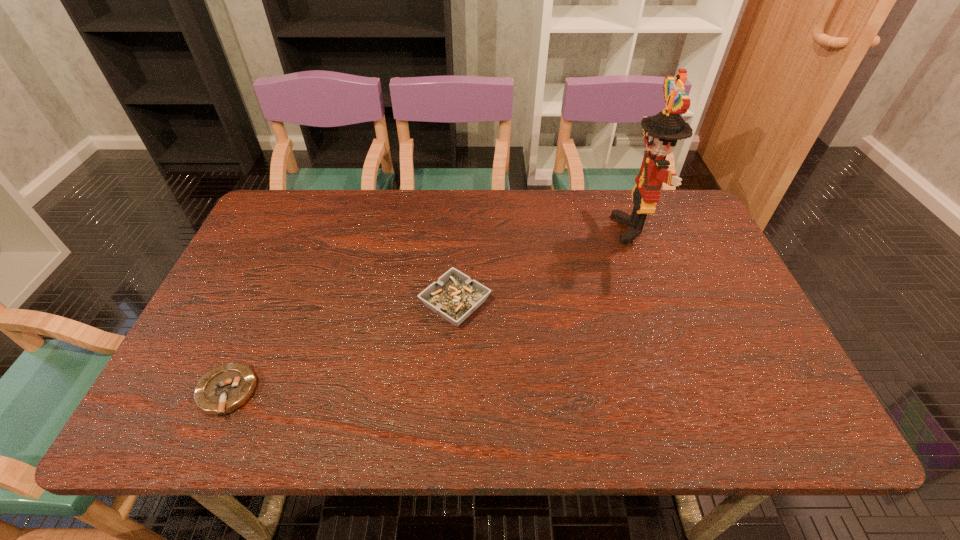
You are a GUI agent. You are given a task and a screenshot of the screen. Output one action in this format:
    pyautogui.click(x=<x>, y=<y>)
    Task: Click on the empty space between the taller ashtray and the nearer ashtray
    The image size is (960, 540).
    Given the screenshot: What is the action you would take?
    pyautogui.click(x=341, y=348)

Identify the location of free space between the nearest object and the second farthest object. The image size is (960, 540). (341, 348).

What are the coordinates of `vacant point located between the second object from right to left and the leftmost object` in the screenshot? It's located at (341, 348).

Image resolution: width=960 pixels, height=540 pixels. What are the coordinates of `vacant space that's between the farthest object and the taller ashtray` in the screenshot? It's located at (545, 266).

Identify which object is the second nearest to the shorter ashtray. Please provide its 2D coordinates. Your answer should be formatted as a tuple, i.e. [(x, y)], where the tuple contains the x and y coordinates of a point satisfying the conditions above.

[(661, 132)]

Locate an element on the screen. The width and height of the screenshot is (960, 540). object that is the closest to the nutcracker is located at coordinates (454, 296).

The image size is (960, 540). In order to click on vacant space that satisfies the following two spatial constraints: 1. on the back side of the nearer ashtray; 2. on the left side of the farther ashtray in this screenshot , I will do pyautogui.click(x=266, y=303).

Find the location of a particular element. The image size is (960, 540). vacant region that satisfies the following two spatial constraints: 1. on the back side of the nearer ashtray; 2. on the right side of the second shortest object is located at coordinates (266, 303).

This screenshot has height=540, width=960. In order to click on vacant space that satisfies the following two spatial constraints: 1. on the back side of the shorter ashtray; 2. on the left side of the second nearest object in this screenshot , I will do `click(266, 303)`.

You are a GUI agent. You are given a task and a screenshot of the screen. Output one action in this format:
    pyautogui.click(x=<x>, y=<y>)
    Task: Click on the blank area in the image that satisfies the following two spatial constraints: 1. on the front-facing side of the tallest object; 2. on the front side of the shorter ashtray
    
    Given the screenshot: What is the action you would take?
    pyautogui.click(x=696, y=393)